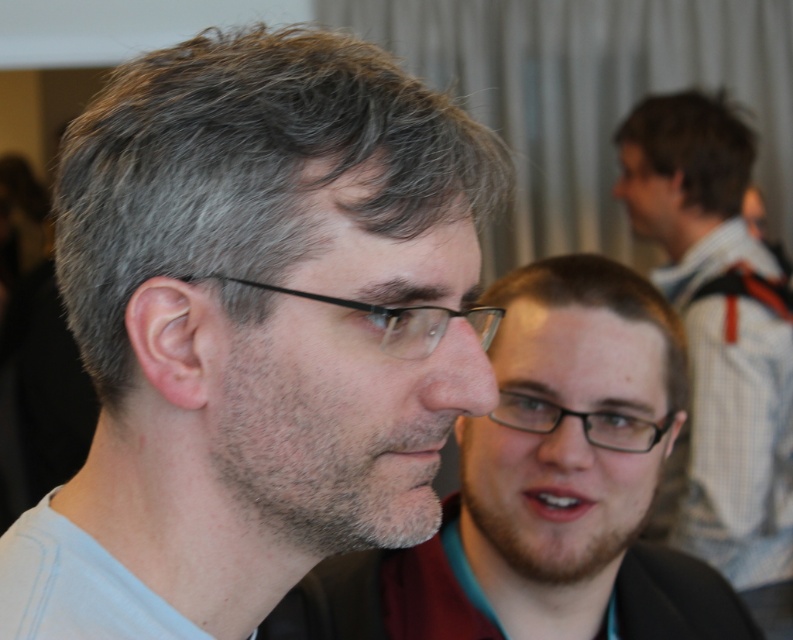
Who is shorter, gray hair at center or dark brown hair at upper right?

With less height is dark brown hair at upper right.

Is point (213, 636) positioned in front of point (738, 129)?

Yes, it is in front of point (738, 129).

In order to click on gray hair at center in this screenshot , I will do `click(255, 330)`.

Does light brown hair at right appear on the right side of black plastic glasses at left?

Correct, you'll find light brown hair at right to the right of black plastic glasses at left.

Can you confirm if light brown hair at right is wider than black plastic glasses at left?

Yes, light brown hair at right is wider than black plastic glasses at left.

This screenshot has width=793, height=640. I want to click on light brown hair at right, so click(721, 340).

In order to click on light brown hair at right in this screenshot , I will do `click(721, 340)`.

Does gray hair at center have a lesser height compared to black plastic glasses at left?

No.

Who is taller, gray hair at center or black plastic glasses at left?

gray hair at center

Find the location of `gray hair at center`. gray hair at center is located at coordinates (255, 330).

Find the location of `gray hair at center`. gray hair at center is located at coordinates (255, 330).